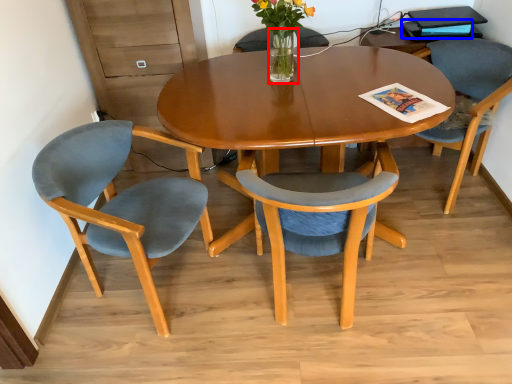
Question: Which object appears farthest to the camera in this image, vase (highlighted by a red box) or magazine (highlighted by a blue box)?

Choices:
 (A) vase
 (B) magazine

Answer: (B)